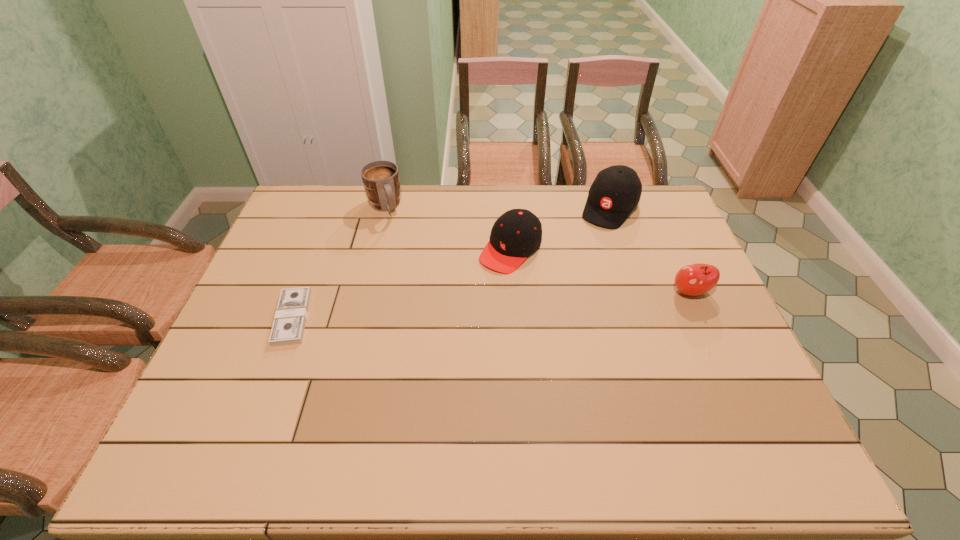
Image resolution: width=960 pixels, height=540 pixels. What are the coordinates of `the leftmost object` in the screenshot? It's located at (289, 322).

Locate an element on the screen. The width and height of the screenshot is (960, 540). the shortest object is located at coordinates (289, 322).

Image resolution: width=960 pixels, height=540 pixels. What are the coordinates of `apple` in the screenshot? It's located at (696, 279).

The width and height of the screenshot is (960, 540). I want to click on cap, so click(516, 234).

Where is `mug`? mug is located at coordinates (380, 178).

What are the coordinates of `baseball cap` in the screenshot? It's located at (616, 191).

At what (x,y) coordinates should I click in order to perform the action: click on vacant area located on the right of the dollar. Please return your answer as a coordinate pair (x, y). The height and width of the screenshot is (540, 960). Looking at the image, I should click on point(401,318).

The image size is (960, 540). I want to click on vacant space located on the stem of the apple, so click(707, 329).

Locate an element on the screen. The width and height of the screenshot is (960, 540). vacant space located on the front-facing side of the third object from right to left is located at coordinates (463, 303).

The height and width of the screenshot is (540, 960). What are the coordinates of `free space located 0.350m on the front-facing side of the third object from right to left` in the screenshot? It's located at (x=420, y=349).